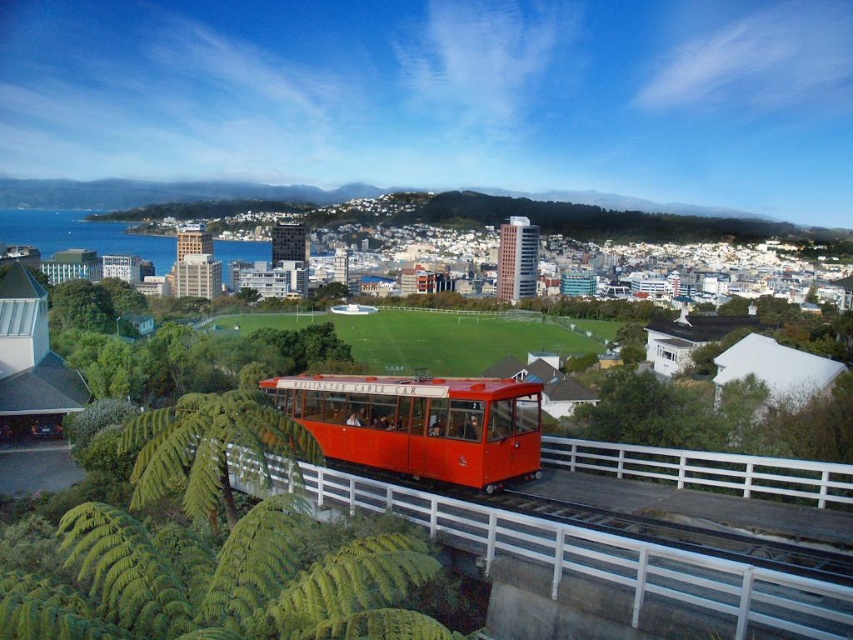
Between metallic red cable car at center and white metal rail at center, which one is positioned higher?

white metal rail at center is above.

Is point (683, 566) closer to camera compared to point (587, 468)?

Yes, point (683, 566) is in front of point (587, 468).

Identify the location of metallic red cable car at center. Image resolution: width=853 pixels, height=640 pixels. (573, 548).

Can you confirm if shiny red cable car at center is shorter than white metal rail at center?

Incorrect, shiny red cable car at center's height does not fall short of white metal rail at center's.

Can you confirm if shiny red cable car at center is positioned to the left of white metal rail at center?

Indeed, shiny red cable car at center is positioned on the left side of white metal rail at center.

Between point (467, 403) and point (607, 467), which one is positioned behind?

The point (607, 467) is behind.

The image size is (853, 640). Identify the location of shiny red cable car at center. (421, 422).

Does metallic red cable car at center appear over shiny red cable car at center?

Actually, metallic red cable car at center is below shiny red cable car at center.

Is point (260, 488) positioned in front of point (454, 412)?

Yes, it is.

Identify the location of metallic red cable car at center. (573, 548).